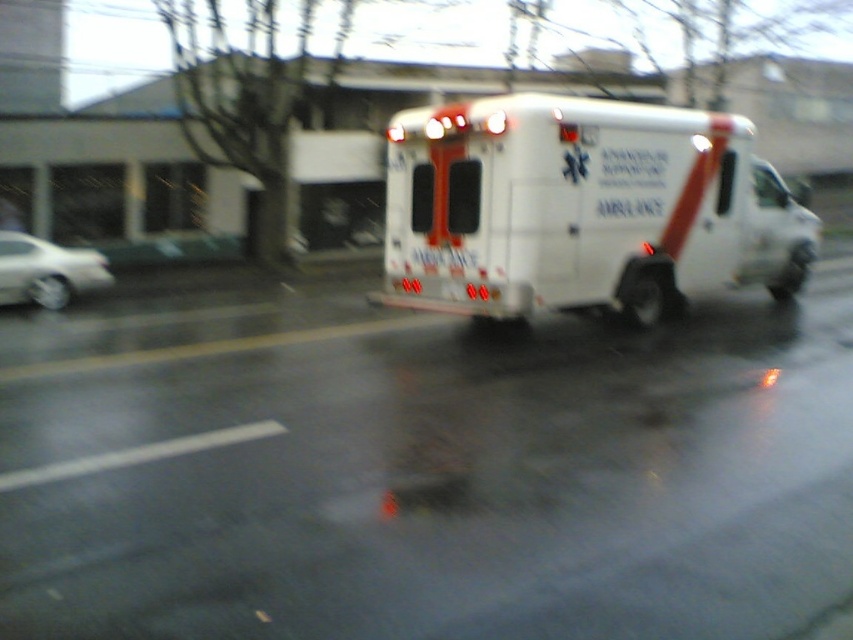
Question: Is white glossy ambulance at center bigger than silver metallic sedan at left?

Choices:
 (A) yes
 (B) no

Answer: (A)

Question: Among these objects, which one is farthest from the camera?

Choices:
 (A) silver metallic sedan at left
 (B) white glossy ambulance at center

Answer: (A)

Question: Where is white glossy ambulance at center located in relation to silver metallic sedan at left in the image?

Choices:
 (A) above
 (B) below

Answer: (A)

Question: Is white glossy ambulance at center above silver metallic sedan at left?

Choices:
 (A) no
 (B) yes

Answer: (B)